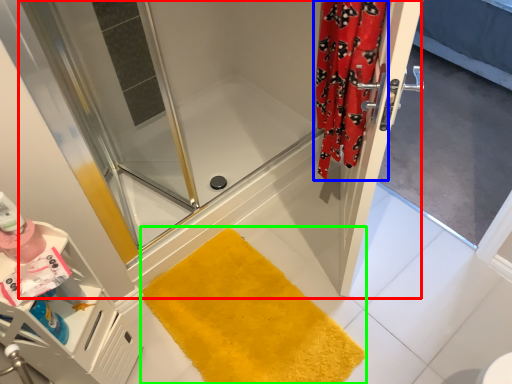
Question: Estimate the real-world distances between objects in this image. Which object is closer to shower door (highlighted by a red box), shower curtain (highlighted by a blue box) or bath mat (highlighted by a green box)?

Choices:
 (A) shower curtain
 (B) bath mat

Answer: (A)